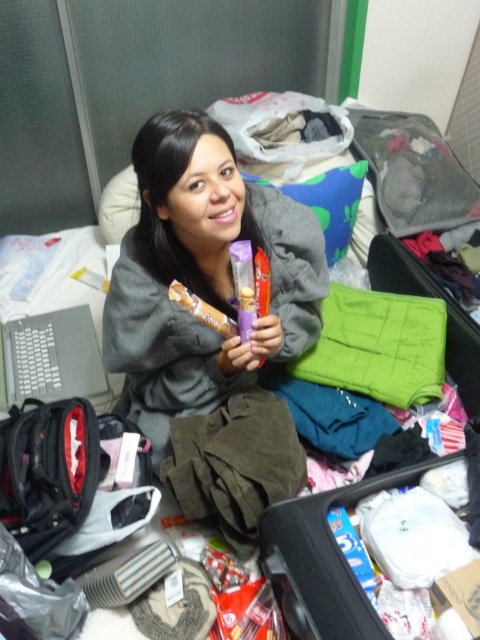
Does green quilted bag at center have a smaller size compared to green quilted blanket at center?

No, green quilted bag at center is not smaller than green quilted blanket at center.

Is green quilted bag at center wider than green quilted blanket at center?

Correct, the width of green quilted bag at center exceeds that of green quilted blanket at center.

The image size is (480, 640). What do you see at coordinates (323, 563) in the screenshot?
I see `green quilted bag at center` at bounding box center [323, 563].

Where is `green quilted bag at center`? The image size is (480, 640). green quilted bag at center is located at coordinates (323, 563).

Does point (458, 378) come behind point (384, 346)?

Yes, point (458, 378) is behind point (384, 346).

Describe the element at coordinates (419, 220) in the screenshot. The image size is (480, 640). I see `green quilted suitcase at center-right` at that location.

You are a GUI agent. You are given a task and a screenshot of the screen. Output one action in this format:
    pyautogui.click(x=<x>, y=<y>)
    Task: Click on the green quilted suitcase at center-right
    The width and height of the screenshot is (480, 640).
    Given the screenshot: What is the action you would take?
    click(x=419, y=220)

Which is behind, point (340, 348) or point (303, 193)?

The point (303, 193) is more distant.

Can you confirm if green quilted blanket at center is positioned to the right of blue fabric pillow at upper center?

Indeed, green quilted blanket at center is positioned on the right side of blue fabric pillow at upper center.

Is point (392, 324) positioned behind point (117, 179)?

That is False.

The width and height of the screenshot is (480, 640). In order to click on green quilted blanket at center in this screenshot , I will do `click(379, 346)`.